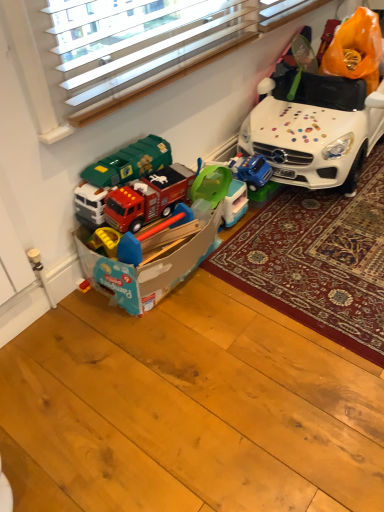
Question: Does white carpet at center have a lesser width compared to white glossy toy car at upper right?

Choices:
 (A) yes
 (B) no

Answer: (B)

Question: Is white carpet at center oriented towards white glossy toy car at upper right?

Choices:
 (A) no
 (B) yes

Answer: (A)

Question: Is white glossy toy car at upper right a part of white carpet at center?

Choices:
 (A) yes
 (B) no

Answer: (B)

Question: Is white carpet at center at the right side of white glossy toy car at upper right?

Choices:
 (A) yes
 (B) no

Answer: (A)

Question: Is white carpet at center next to white glossy toy car at upper right?

Choices:
 (A) no
 (B) yes

Answer: (A)

Question: Based on their positions, is white glossy toy car at upper right located to the left or right of matte plastic toy box at lower left, placed as the second toy when sorted from back to front?

Choices:
 (A) left
 (B) right

Answer: (B)

Question: From the image's perspective, is white glossy toy car at upper right located above or below matte plastic toy box at lower left, marked as the 1th toy in a front-to-back arrangement?

Choices:
 (A) above
 (B) below

Answer: (A)

Question: From a real-world perspective, relative to matte plastic toy box at lower left, placed as the second toy when sorted from back to front, is white glossy toy car at upper right vertically above or below?

Choices:
 (A) below
 (B) above

Answer: (B)

Question: Is white glossy toy car at upper right wider or thinner than matte plastic toy box at lower left, placed as the second toy when sorted from back to front?

Choices:
 (A) thin
 (B) wide

Answer: (B)

Question: Is white carpet at center taller or shorter than white glossy toy car at upper right?

Choices:
 (A) tall
 (B) short

Answer: (B)

Question: From the image's perspective, is white carpet at center above or below white glossy toy car at upper right?

Choices:
 (A) above
 (B) below

Answer: (B)

Question: Is white carpet at center situated inside white glossy toy car at upper right or outside?

Choices:
 (A) outside
 (B) inside

Answer: (A)

Question: In the image, is white carpet at center positioned in front of or behind white glossy toy car at upper right?

Choices:
 (A) front
 (B) behind

Answer: (A)

Question: Is point (210, 176) positioned closer to the camera than point (365, 137)?

Choices:
 (A) closer
 (B) farther

Answer: (A)

Question: Is green plastic toy at center, acting as the second toy starting from the front, wider or thinner than white glossy toy car at upper right?

Choices:
 (A) wide
 (B) thin

Answer: (B)